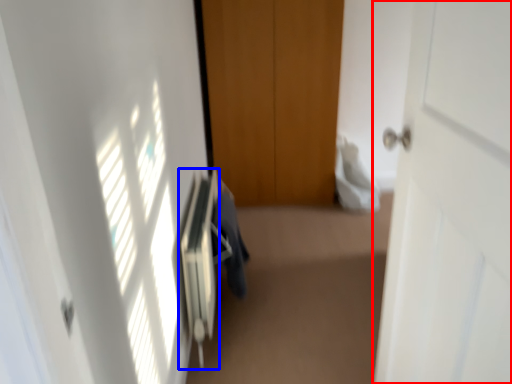
Question: Which object is closer to the camera taking this photo, door (highlighted by a red box) or radiator (highlighted by a blue box)?

Choices:
 (A) door
 (B) radiator

Answer: (A)